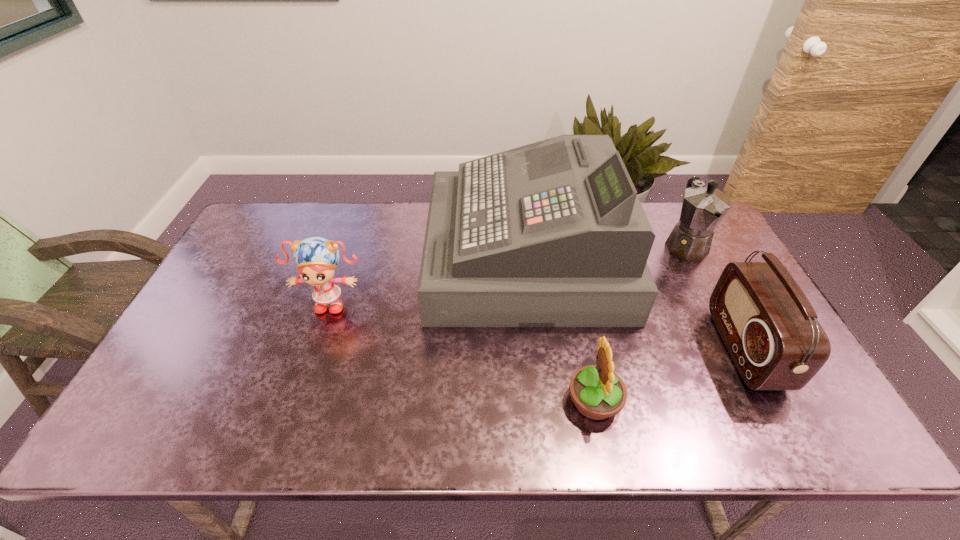
Image resolution: width=960 pixels, height=540 pixels. In order to click on radio receiver present at the right edge in this screenshot , I will do `click(769, 327)`.

This screenshot has height=540, width=960. What are the coordinates of `object that is at the far right corner` in the screenshot? It's located at (703, 208).

Find the location of a particular element. The image size is (960, 540). free point at the far edge is located at coordinates (407, 202).

This screenshot has width=960, height=540. What are the coordinates of `free space at the near edge` in the screenshot? It's located at (646, 435).

The width and height of the screenshot is (960, 540). Identify the location of free space at the left edge of the desktop. (210, 393).

Where is `vacant space at the far left corner of the desktop`? This screenshot has width=960, height=540. vacant space at the far left corner of the desktop is located at coordinates (253, 243).

Identify the location of free space at the near left corner of the desktop. (164, 423).

Where is `free area in between the doll and the sunflower`? The image size is (960, 540). free area in between the doll and the sunflower is located at coordinates (463, 351).

Identify the location of empty space that is in between the doll and the sunflower. This screenshot has width=960, height=540. (463, 351).

I want to click on object identified as the closest to the radio receiver, so click(x=703, y=208).